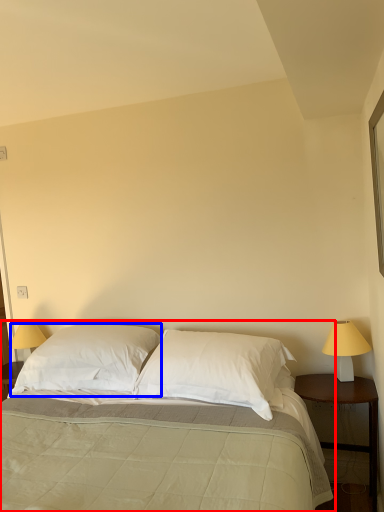
Question: Among these objects, which one is farthest to the camera, bed (highlighted by a red box) or pillow (highlighted by a blue box)?

Choices:
 (A) bed
 (B) pillow

Answer: (B)